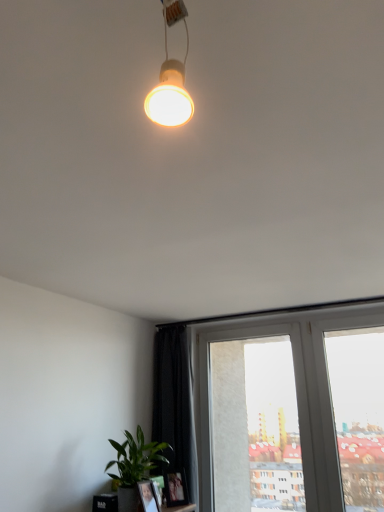
Question: In terms of size, does green matte plant at lower left appear bigger or smaller than white plastic window frame at center?

Choices:
 (A) big
 (B) small

Answer: (B)

Question: From the image's perspective, is green matte plant at lower left above or below white plastic window frame at center?

Choices:
 (A) below
 (B) above

Answer: (B)

Question: From a real-world perspective, is green matte plant at lower left positioned above or below white plastic window frame at center?

Choices:
 (A) below
 (B) above

Answer: (A)

Question: Does point (215, 331) appear closer or farther from the camera than point (152, 453)?

Choices:
 (A) closer
 (B) farther

Answer: (B)

Question: From a real-world perspective, is white plastic window frame at center positioned above or below green matte plant at lower left?

Choices:
 (A) below
 (B) above

Answer: (B)

Question: Looking at the image, does white plastic window frame at center seem bigger or smaller compared to green matte plant at lower left?

Choices:
 (A) big
 (B) small

Answer: (A)

Question: In the image, is white plastic window frame at center positioned in front of or behind green matte plant at lower left?

Choices:
 (A) behind
 (B) front

Answer: (A)